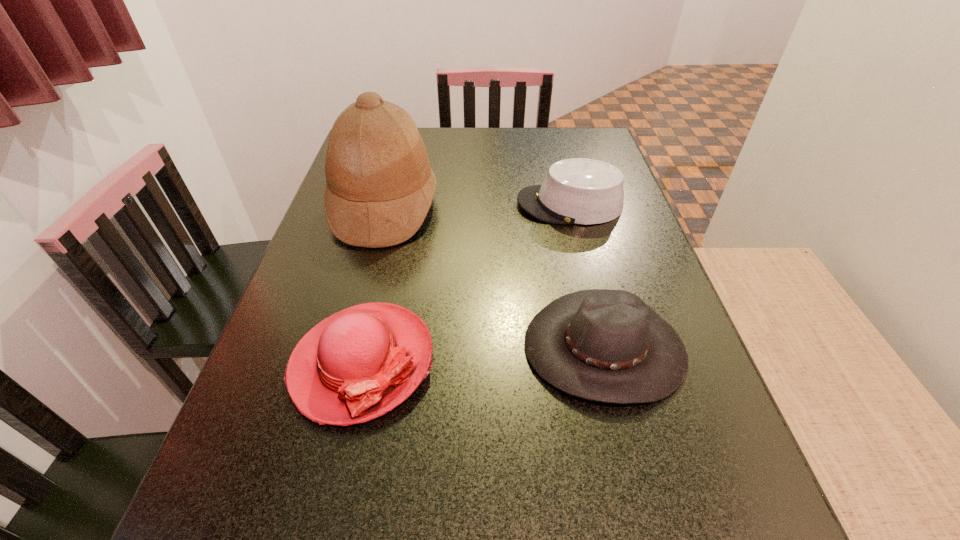
Locate an element on the screen. The height and width of the screenshot is (540, 960). the tallest hat is located at coordinates (379, 188).

Identify the location of free spot located 0.360m on the front-facing side of the tallest object. (578, 206).

Find the location of `vacant space at the far edge of the desktop`. vacant space at the far edge of the desktop is located at coordinates (527, 127).

The height and width of the screenshot is (540, 960). In order to click on vacant area at the left edge in this screenshot , I will do `click(336, 289)`.

Where is `free space at the right edge of the desktop`? The width and height of the screenshot is (960, 540). free space at the right edge of the desktop is located at coordinates (671, 534).

This screenshot has height=540, width=960. In the image, there is a desktop. In order to click on vacant space at the far right corner in this screenshot , I will do 559,144.

The image size is (960, 540). I want to click on object that can be found as the second closest to the tallest object, so click(583, 191).

Where is `the third closest object to the tallest object`? the third closest object to the tallest object is located at coordinates (604, 345).

The height and width of the screenshot is (540, 960). Identify the location of the second closest hat to the tallest object. (583, 191).

Image resolution: width=960 pixels, height=540 pixels. Find the location of `hat that is the second closest one to the tallest hat`. hat that is the second closest one to the tallest hat is located at coordinates (583, 191).